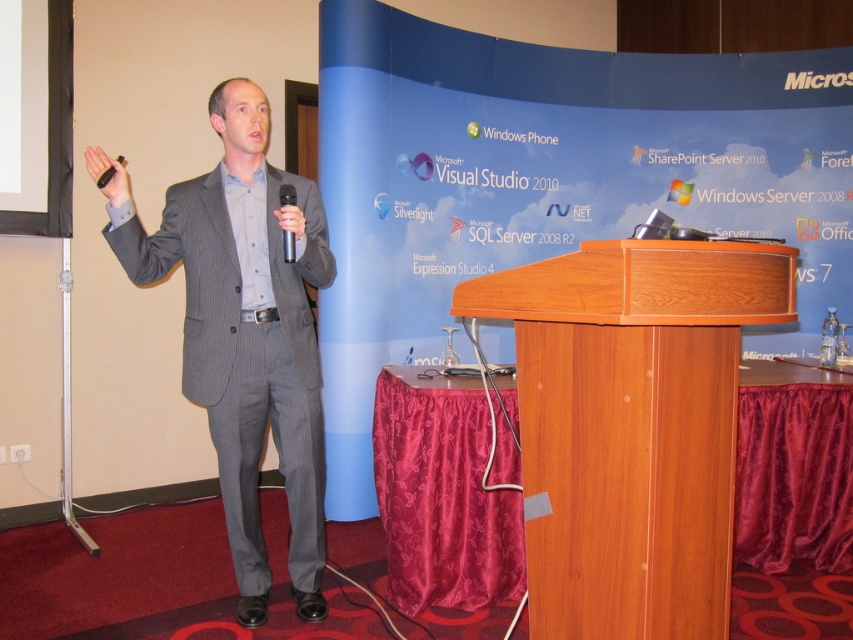
Question: Among these objects, which one is farthest from the camera?

Choices:
 (A) wooden podium at center
 (B) gray pinstripe suit at left
 (C) black matte microphone at upper left
 (D) black plastic microphone at center

Answer: (D)

Question: Among these points, which one is nearest to the camera?

Choices:
 (A) (109, 176)
 (B) (265, 385)
 (C) (675, 486)
 (D) (291, 200)

Answer: (C)

Question: Based on their relative distances, which object is farther from the gray pinstripe suit at left?

Choices:
 (A) black matte microphone at upper left
 (B) black plastic microphone at center
 (C) wooden podium at center

Answer: (C)

Question: Is wooden podium at center positioned in front of gray pinstripe suit at left?

Choices:
 (A) no
 (B) yes

Answer: (B)

Question: Considering the relative positions of gray pinstripe suit at left and black plastic microphone at center in the image provided, where is gray pinstripe suit at left located with respect to black plastic microphone at center?

Choices:
 (A) right
 (B) left

Answer: (B)

Question: Can you confirm if wooden podium at center is positioned to the left of black plastic microphone at center?

Choices:
 (A) yes
 (B) no

Answer: (B)